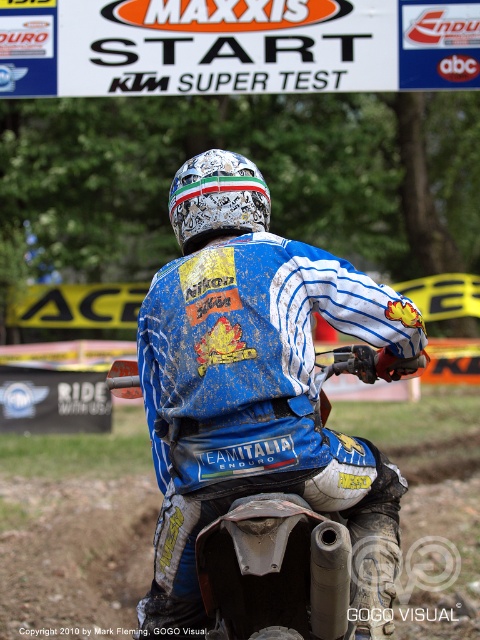
Question: Among these points, which one is farthest from the camera?

Choices:
 (A) (203, 198)
 (B) (180, 193)

Answer: (B)

Question: Is blue/white jersey at center to the right of shiny metallic helmet at center from the viewer's perspective?

Choices:
 (A) yes
 (B) no

Answer: (A)

Question: Does blue/white jersey at center appear on the right side of shiny metallic helmet at center?

Choices:
 (A) yes
 (B) no

Answer: (A)

Question: Which point appears closest to the camera in this image?

Choices:
 (A) (196, 444)
 (B) (196, 160)

Answer: (A)

Question: Does blue/white jersey at center have a larger size compared to shiny metallic helmet at center?

Choices:
 (A) yes
 (B) no

Answer: (A)